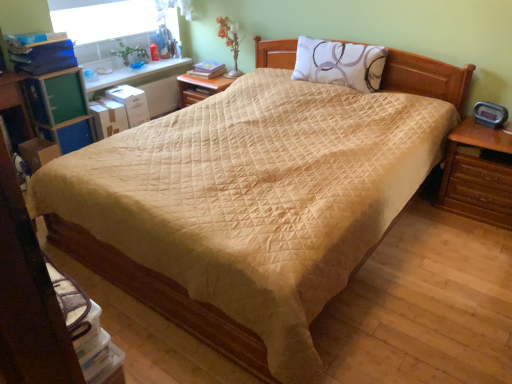
Question: Is white printed pillow at upper center bigger than white plastic window screen at upper left?

Choices:
 (A) yes
 (B) no

Answer: (B)

Question: Is white printed pillow at upper center further to the viewer compared to white plastic window screen at upper left?

Choices:
 (A) no
 (B) yes

Answer: (A)

Question: From a real-world perspective, is white printed pillow at upper center positioned over white plastic window screen at upper left based on gravity?

Choices:
 (A) yes
 (B) no

Answer: (B)

Question: Is white plastic window screen at upper left inside white printed pillow at upper center?

Choices:
 (A) no
 (B) yes

Answer: (A)

Question: Is white printed pillow at upper center outside of white plastic window screen at upper left?

Choices:
 (A) yes
 (B) no

Answer: (A)

Question: Considering their positions, is white plastic window screen at upper left located in front of or behind white printed pillow at upper center?

Choices:
 (A) front
 (B) behind

Answer: (B)

Question: From the image's perspective, is white plastic window screen at upper left located above or below white printed pillow at upper center?

Choices:
 (A) above
 (B) below

Answer: (A)

Question: Is white plastic window screen at upper left spatially inside white printed pillow at upper center, or outside of it?

Choices:
 (A) inside
 (B) outside

Answer: (B)

Question: Based on their sizes in the image, would you say white plastic window screen at upper left is bigger or smaller than white printed pillow at upper center?

Choices:
 (A) small
 (B) big

Answer: (B)

Question: From a real-world perspective, relative to white plastic window screen at upper left, is white printed pillow at upper center vertically above or below?

Choices:
 (A) above
 (B) below

Answer: (B)

Question: Considering their positions, is white printed pillow at upper center located in front of or behind white plastic window screen at upper left?

Choices:
 (A) front
 (B) behind

Answer: (A)

Question: Considering the positions of white printed pillow at upper center and white plastic window screen at upper left in the image, is white printed pillow at upper center bigger or smaller than white plastic window screen at upper left?

Choices:
 (A) small
 (B) big

Answer: (A)

Question: Considering the positions of white printed pillow at upper center and white plastic window screen at upper left in the image, is white printed pillow at upper center taller or shorter than white plastic window screen at upper left?

Choices:
 (A) tall
 (B) short

Answer: (B)

Question: Considering the positions of white printed pillow at upper center and matte yellow book at center in the image, is white printed pillow at upper center taller or shorter than matte yellow book at center?

Choices:
 (A) short
 (B) tall

Answer: (B)

Question: From a real-world perspective, is white printed pillow at upper center physically located above or below matte yellow book at center?

Choices:
 (A) above
 (B) below

Answer: (A)